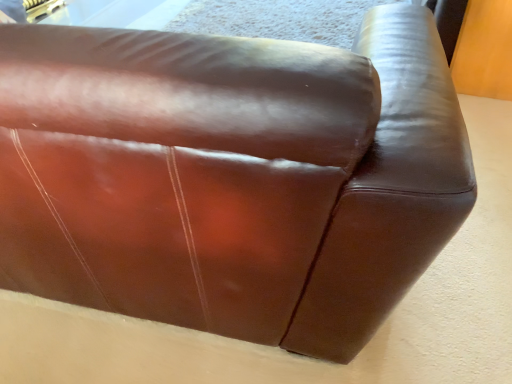
In order to face transparent glass table at upper left, should I rotate leftwards or rightwards?

You should rotate left by 22.255 degrees.

What are the coordinates of `transparent glass table at upper left` in the screenshot? It's located at (117, 13).

The image size is (512, 384). What do you see at coordinates (117, 13) in the screenshot? I see `transparent glass table at upper left` at bounding box center [117, 13].

What are the coordinates of `transparent glass table at upper left` in the screenshot? It's located at (117, 13).